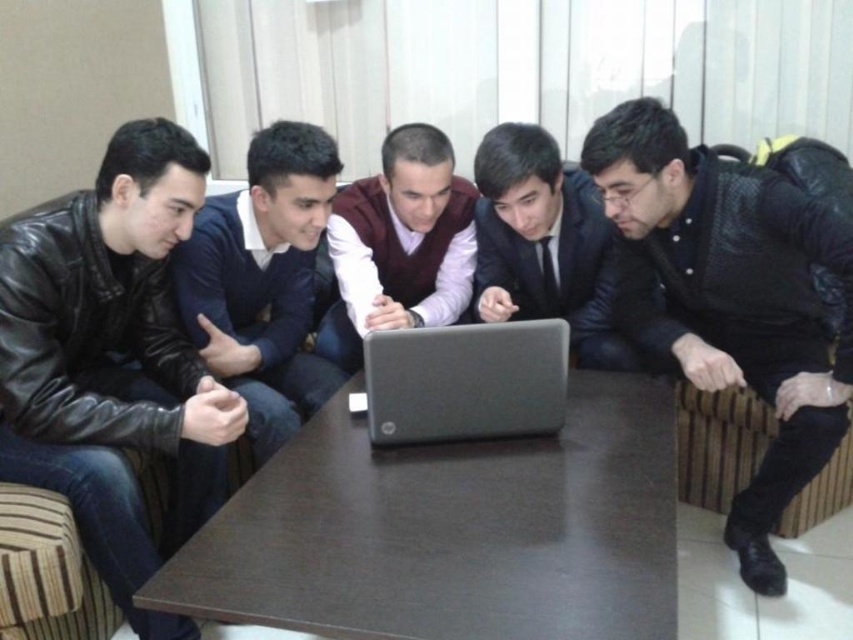
Question: Which object appears farthest from the camera in this image?

Choices:
 (A) maroon sweater at center
 (B) black matte laptop at center
 (C) dark blue sweater at center
 (D) matte black suit at center

Answer: (A)

Question: Among these objects, which one is farthest from the camera?

Choices:
 (A) brown matte table at center
 (B) black leather jacket at lower right
 (C) black matte laptop at center
 (D) leather jacket at left

Answer: (B)

Question: Is leather jacket at left positioned before maroon sweater at center?

Choices:
 (A) yes
 (B) no

Answer: (A)

Question: Does dark blue sweater at center have a larger size compared to matte black suit at center?

Choices:
 (A) no
 (B) yes

Answer: (B)

Question: Does dark blue sweater at center have a greater width compared to maroon sweater at center?

Choices:
 (A) yes
 (B) no

Answer: (B)

Question: Which point appears closest to the camera in this image?

Choices:
 (A) (775, 465)
 (B) (76, 428)

Answer: (B)